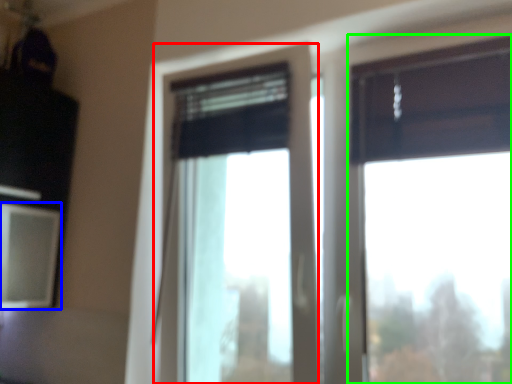
Question: Based on their relative distances, which object is nearer to window (highlighted by a red box)? Choose from window screen (highlighted by a blue box) and window (highlighted by a green box).

Choices:
 (A) window screen
 (B) window

Answer: (A)